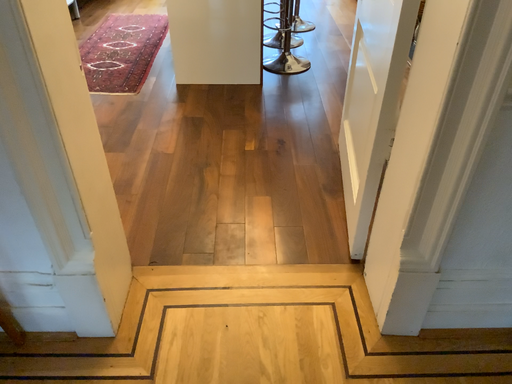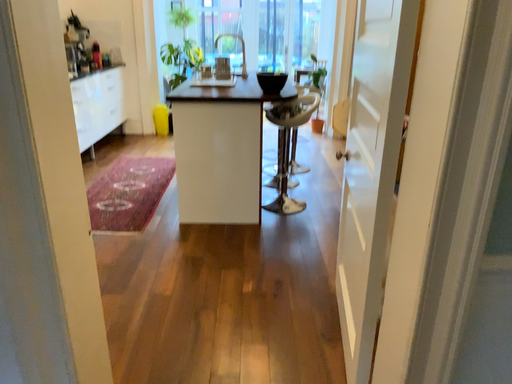
Question: Which way did the camera rotate in the video?

Choices:
 (A) rotated upward
 (B) rotated downward

Answer: (A)